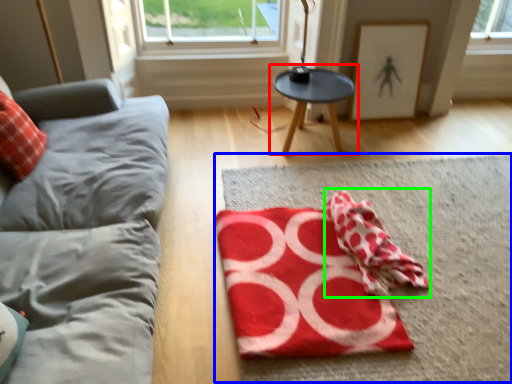
Question: Which object is the farthest from table (highlighted by a red box)? Choose among these: mat (highlighted by a blue box) or beach towel (highlighted by a green box).

Choices:
 (A) mat
 (B) beach towel

Answer: (B)